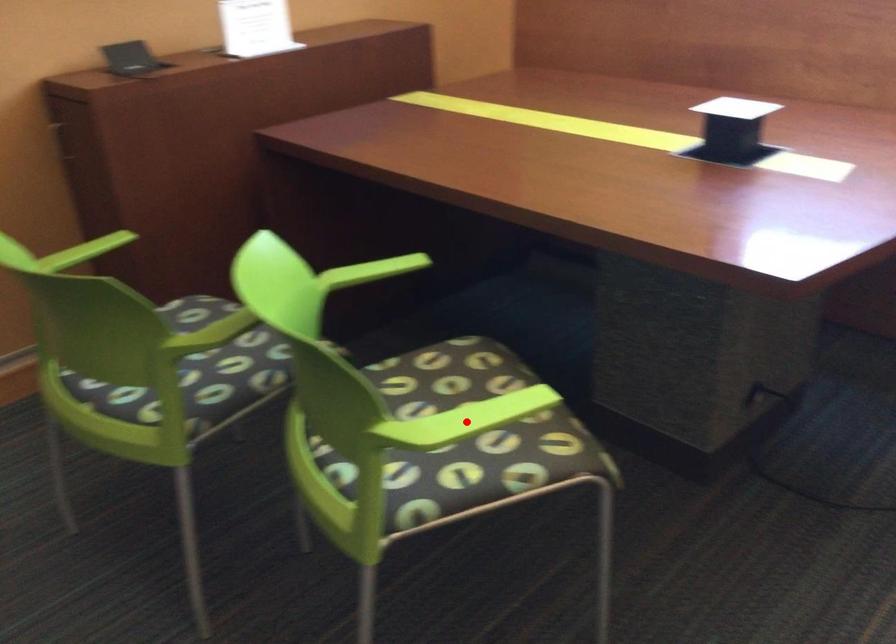
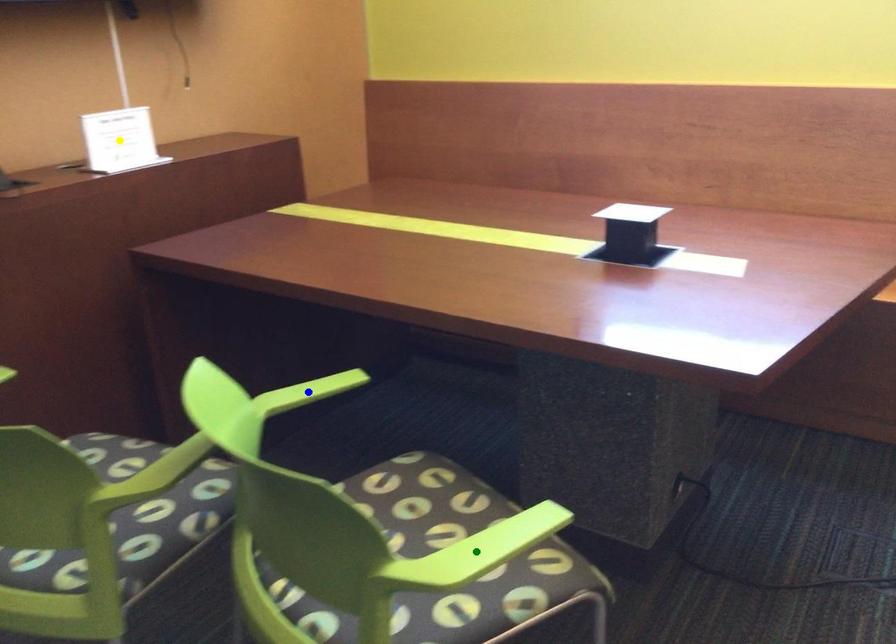
Question: I am providing you with two images of the same scene from different viewpoints. A red point is marked on the first image. You are given multiple points on the second image. Which mark in image 2 goes with the point in image 1?

Choices:
 (A) green point
 (B) yellow point
 (C) blue point

Answer: (A)